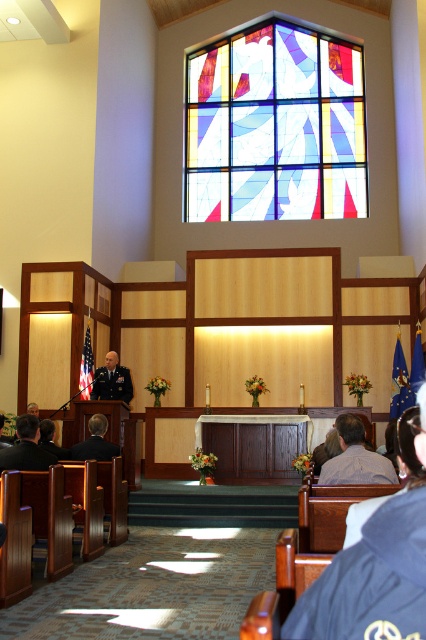
Question: Which point appears farthest from the camera in this image?

Choices:
 (A) (112, 362)
 (B) (97, 454)
 (C) (322, 204)
 (D) (36, 417)

Answer: (C)

Question: Which of these objects is positioned closest to the blue denim jacket at lower right?

Choices:
 (A) dark blue uniform at center
 (B) stained glass window at upper center

Answer: (A)

Question: Is light brown leather jacket at lower center to the right of dark blue uniform at center from the viewer's perspective?

Choices:
 (A) yes
 (B) no

Answer: (A)

Question: From the image, what is the correct spatial relationship of blue denim jacket at lower right in relation to dark blue uniform at lower left?

Choices:
 (A) right
 (B) left

Answer: (A)

Question: Which point is closer to the camera taking this photo?

Choices:
 (A) (325, 467)
 (B) (11, 465)
 (C) (247, 83)
 (D) (86, 442)

Answer: (A)

Question: Is stained glass window at upper center bigger than dark blue uniform at lower left?

Choices:
 (A) yes
 (B) no

Answer: (B)